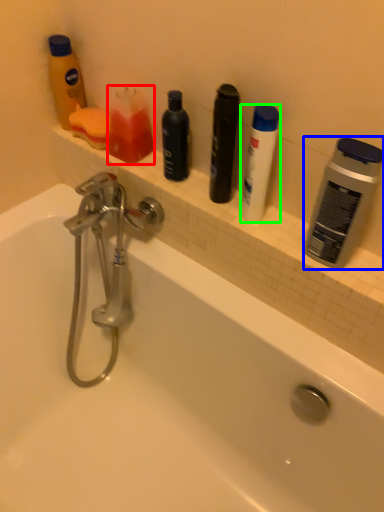
Question: Which object is positioned farthest from toiletry (highlighted by a red box)? Select from personal care (highlighted by a blue box) and toiletry (highlighted by a green box).

Choices:
 (A) personal care
 (B) toiletry

Answer: (A)